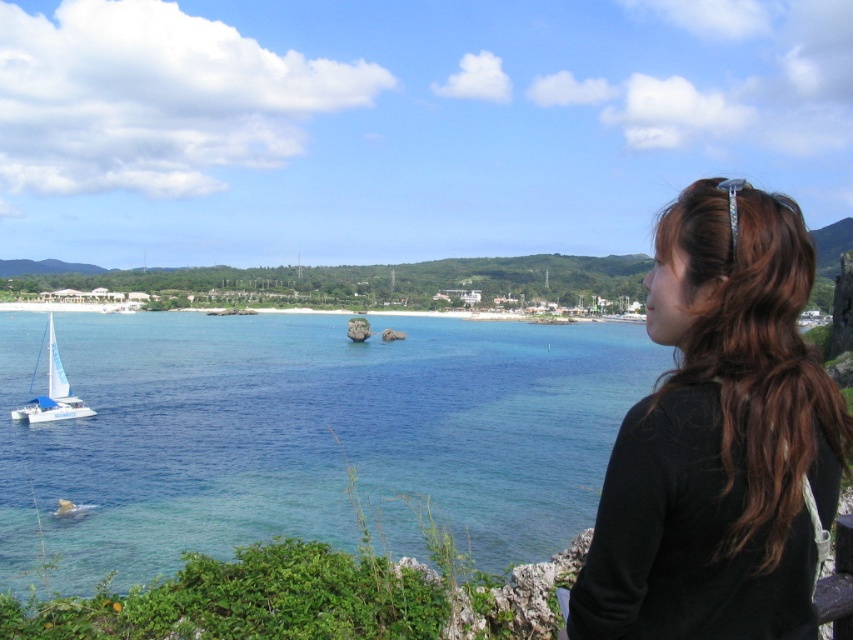
Question: Which of the following is the closest to the observer?

Choices:
 (A) (674, 380)
 (B) (70, 410)
 (C) (526, 548)

Answer: (A)

Question: Can you confirm if brown hair at upper right is thinner than white sailboat at lower left?

Choices:
 (A) yes
 (B) no

Answer: (A)

Question: Which point is farther from the camera taking this photo?

Choices:
 (A) (54, 396)
 (B) (27, 467)
 (C) (779, 416)

Answer: (A)

Question: Is clear blue water at center closer to camera compared to white sailboat at lower left?

Choices:
 (A) no
 (B) yes

Answer: (B)

Question: Which point is closer to the camera?

Choices:
 (A) (300, 436)
 (B) (30, 420)
 (C) (775, 340)

Answer: (C)

Question: Observing the image, what is the correct spatial positioning of clear blue water at center in reference to brown hair at upper right?

Choices:
 (A) left
 (B) right

Answer: (A)